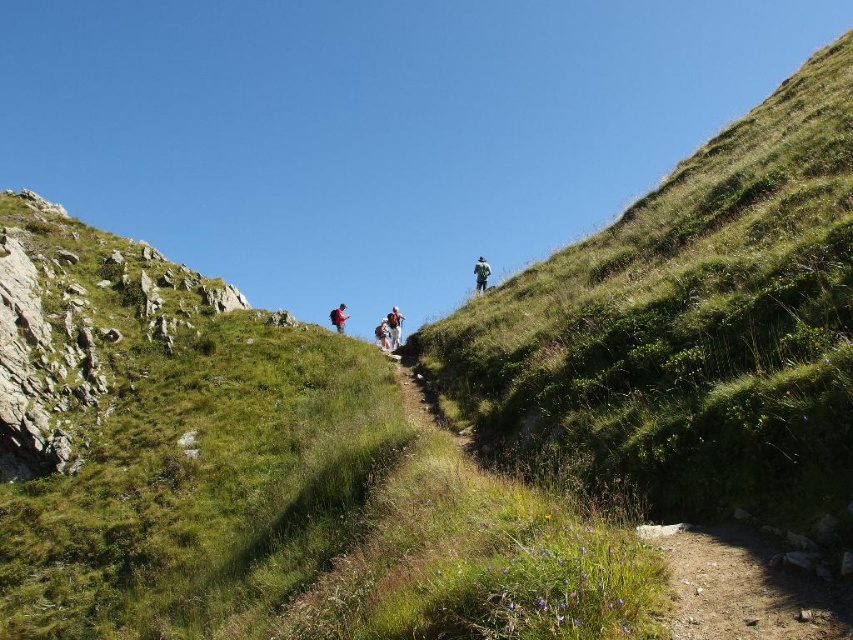
Consider the image. You are a hiker planning to take a photo of the green fabric backpack at upper center and the white fabric backpack at center. Since you want to capture both backpacks in the frame, which backpack should you focus on to ensure both are in the shot?

The green fabric backpack at upper center is much taller than the white fabric backpack at center. To capture both in the frame, focus on the green fabric backpack at upper center as it is taller and likely positioned higher up the trail, allowing the white one to be included below.

You are a hiker standing at the bottom of the trail and want to reach the green grassy hillside at upper center. Which direction should you move in to get there?

You should move upward to reach the green grassy hillside at upper center since it is located at point [685,330], which is above your current position at the bottom of the trail.